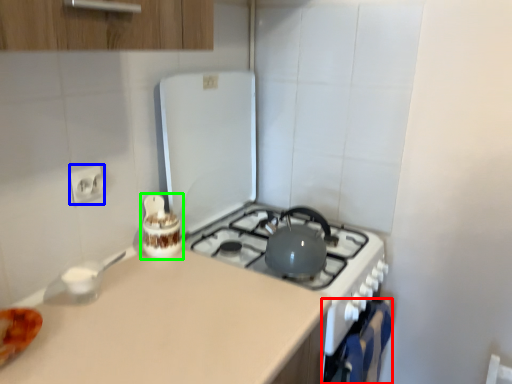
Question: Based on their relative distances, which object is farther from oven (highlighted by a red box)? Choose from electric outlet (highlighted by a blue box) and appliance (highlighted by a green box).

Choices:
 (A) electric outlet
 (B) appliance

Answer: (A)